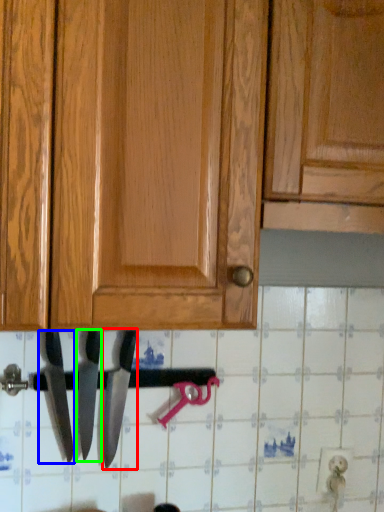
Question: Which object is the closest to the knife (highlighted by a red box)? Choose among these: knife (highlighted by a blue box) or knife (highlighted by a green box).

Choices:
 (A) knife
 (B) knife

Answer: (B)